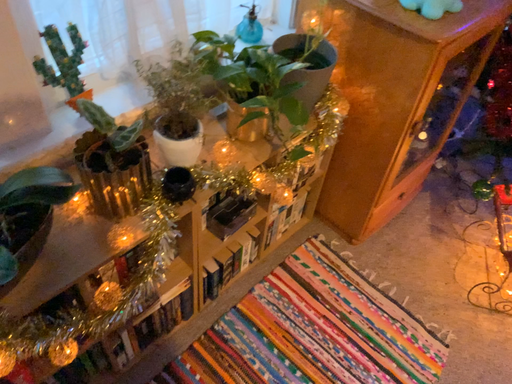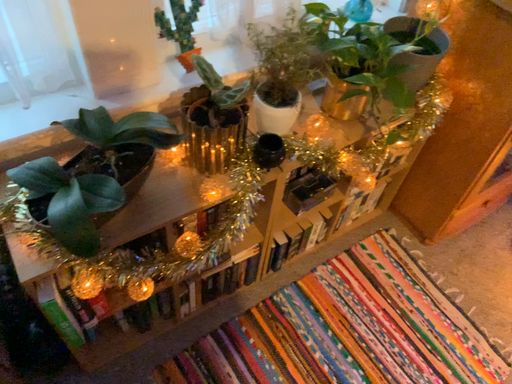
Question: How did the camera likely rotate when shooting the video?

Choices:
 (A) rotated left
 (B) rotated right

Answer: (A)